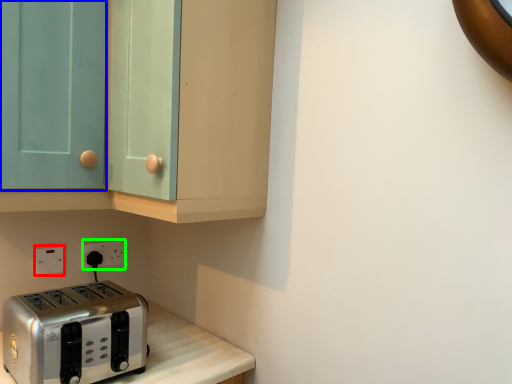
Question: Which object is positioned farthest from electric outlet (highlighted by a red box)? Select from glass door (highlighted by a blue box) and electric outlet (highlighted by a green box).

Choices:
 (A) glass door
 (B) electric outlet

Answer: (A)